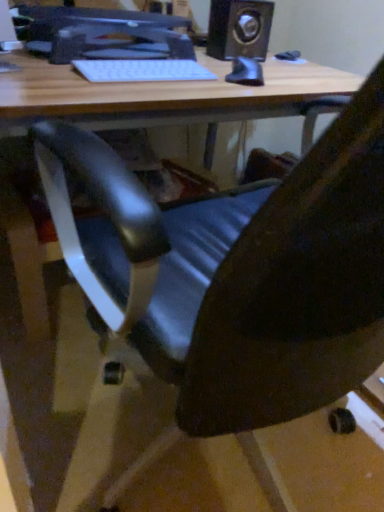
In order to face matte black monitor at upper center, should I rotate leftwards or rightwards?

To align with it, rotate left about 10.818°.

Image resolution: width=384 pixels, height=512 pixels. In order to click on black plastic speaker at upper right in this screenshot , I will do `click(240, 37)`.

Is matte black monitor at upper center with black plastic speaker at upper right?

No, matte black monitor at upper center is not making contact with black plastic speaker at upper right.

Between matte black monitor at upper center and black plastic speaker at upper right, which one has larger size?

With larger size is matte black monitor at upper center.

Is matte black monitor at upper center oriented away from black plastic speaker at upper right?

No, matte black monitor at upper center's orientation is not away from black plastic speaker at upper right.

Considering the relative sizes of matte black monitor at upper center and black plastic speaker at upper right in the image provided, is matte black monitor at upper center wider than black plastic speaker at upper right?

Yes.

Between black plastic speaker at upper right and white matte keyboard at upper center, which one has larger size?

With larger size is black plastic speaker at upper right.

From a real-world perspective, relative to white matte keyboard at upper center, is black plastic speaker at upper right vertically above or below?

From a real-world perspective, black plastic speaker at upper right is physically above white matte keyboard at upper center.

Based on the photo, looking at their sizes, would you say black plastic speaker at upper right is wider or thinner than white matte keyboard at upper center?

In the image, black plastic speaker at upper right appears to be wider than white matte keyboard at upper center.

From the image's perspective, between black plastic speaker at upper right and white matte keyboard at upper center, who is located below?

white matte keyboard at upper center appears lower in the image.

Between black plastic speaker at upper right and matte black monitor at upper center, which one has less height?

matte black monitor at upper center.

Looking at this image, is black plastic speaker at upper right next to matte black monitor at upper center and touching it?

There is a gap between black plastic speaker at upper right and matte black monitor at upper center.

How different are the orientations of black plastic speaker at upper right and matte black monitor at upper center in degrees?

5.15 degrees.

From the image's perspective, is black plastic speaker at upper right positioned above or below matte black monitor at upper center?

black plastic speaker at upper right is above matte black monitor at upper center.

Consider the image. Is matte black monitor at upper center turned away from white matte keyboard at upper center?

That's not correct — matte black monitor at upper center is not looking away from white matte keyboard at upper center.

Considering the relative positions of matte black monitor at upper center and white matte keyboard at upper center in the image provided, is matte black monitor at upper center to the left or to the right of white matte keyboard at upper center?

matte black monitor at upper center is positioned on white matte keyboard at upper center's left side.

Does matte black monitor at upper center have a smaller size compared to white matte keyboard at upper center?

Answer: No, matte black monitor at upper center is not smaller than white matte keyboard at upper center.

Can you tell me how much white matte keyboard at upper center and matte black monitor at upper center differ in facing direction?

The angle between the facing direction of white matte keyboard at upper center and the facing direction of matte black monitor at upper center is 2.99 degrees.

Is white matte keyboard at upper center in front of or behind matte black monitor at upper center in the image?

Clearly, white matte keyboard at upper center is in front of matte black monitor at upper center.

From a real-world perspective, relative to matte black monitor at upper center, is white matte keyboard at upper center vertically above or below?

From a real-world perspective, white matte keyboard at upper center is physically below matte black monitor at upper center.

Which object is positioned more to the right, white matte keyboard at upper center or matte black monitor at upper center?

Positioned to the right is white matte keyboard at upper center.

Choose the correct answer: Is white matte keyboard at upper center inside black plastic speaker at upper right or outside it?

white matte keyboard at upper center is spatially situated outside black plastic speaker at upper right.

Are white matte keyboard at upper center and black plastic speaker at upper right making contact?

No.

Can you confirm if white matte keyboard at upper center is bigger than black plastic speaker at upper right?

Actually, white matte keyboard at upper center might be smaller than black plastic speaker at upper right.

The width and height of the screenshot is (384, 512). What are the coordinates of `speaker that appears above the matte black monitor at upper center (from the image's perspective)` in the screenshot? It's located at (240, 37).

Where is `speaker above the white matte keyboard at upper center (from a real-world perspective)`? The height and width of the screenshot is (512, 384). speaker above the white matte keyboard at upper center (from a real-world perspective) is located at coordinates (240, 37).

From the image, which object appears to be farther from matte black monitor at upper center, black plastic speaker at upper right or white matte keyboard at upper center?

black plastic speaker at upper right is positioned further to the anchor matte black monitor at upper center.

From the image, which object appears to be farther from black plastic speaker at upper right, white matte keyboard at upper center or matte black monitor at upper center?

matte black monitor at upper center.

Based on their spatial positions, is black plastic speaker at upper right or matte black monitor at upper center further from white matte keyboard at upper center?

black plastic speaker at upper right lies further to white matte keyboard at upper center than the other object.

Considering their positions, is matte black monitor at upper center positioned closer to white matte keyboard at upper center than black plastic speaker at upper right?

The object closer to white matte keyboard at upper center is matte black monitor at upper center.

Considering their positions, is matte black monitor at upper center positioned closer to black plastic speaker at upper right than white matte keyboard at upper center?

white matte keyboard at upper center is positioned closer to the anchor black plastic speaker at upper right.

Which object lies nearer to the anchor point matte black monitor at upper center, white matte keyboard at upper center or black plastic speaker at upper right?

The object closer to matte black monitor at upper center is white matte keyboard at upper center.

Where is `laptop keyboard between matte black monitor at upper center and black plastic speaker at upper right in the horizontal direction`? laptop keyboard between matte black monitor at upper center and black plastic speaker at upper right in the horizontal direction is located at coordinates (142, 70).